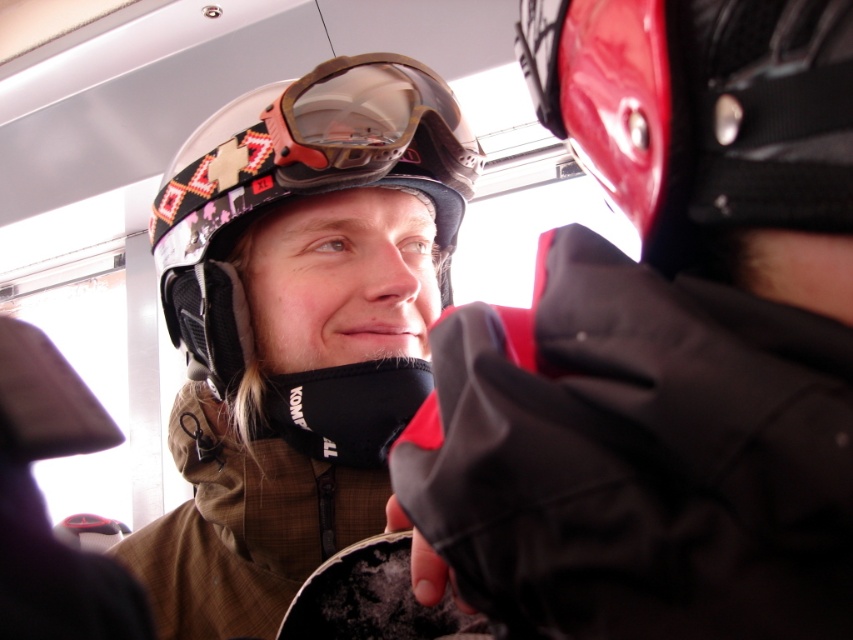
Describe the element at coordinates (664, 342) in the screenshot. I see `matte black helmet at upper left` at that location.

Is matte black helmet at upper left smaller than matte black goggles at center?

No.

Is point (664, 465) in front of point (367, 144)?

Yes, point (664, 465) is closer to viewer.

Image resolution: width=853 pixels, height=640 pixels. What are the coordinates of `matte black helmet at upper left` in the screenshot? It's located at (664, 342).

Which is more to the right, white matte helmet at center or matte black goggles at center?

Positioned to the right is matte black goggles at center.

Where is `white matte helmet at center`? white matte helmet at center is located at coordinates (300, 188).

Is red matte helmet at upper right to the right of white matte helmet at center from the viewer's perspective?

Indeed, red matte helmet at upper right is positioned on the right side of white matte helmet at center.

How much distance is there between red matte helmet at upper right and white matte helmet at center?

red matte helmet at upper right is 11.00 inches from white matte helmet at center.

I want to click on red matte helmet at upper right, so click(x=699, y=109).

Locate an element on the screen. red matte helmet at upper right is located at coordinates coord(699,109).